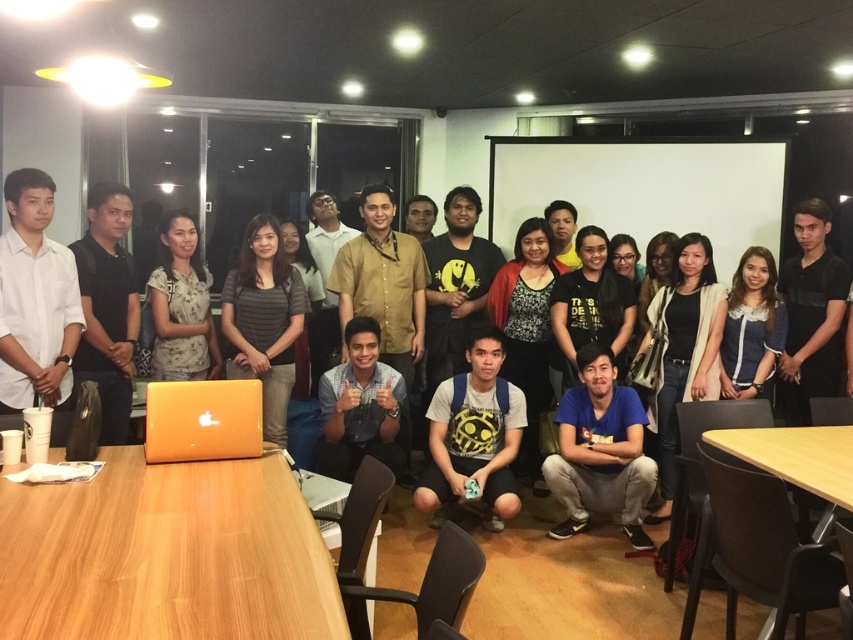
Measure the distance between point (80, 282) and camera.

Point (80, 282) is 3.53 meters away from camera.

Does matte black shirt at left have a greater height compared to light brown printed blouse at center?

Indeed, matte black shirt at left has a greater height compared to light brown printed blouse at center.

Does point (105, 230) come in front of point (195, 289)?

Yes, point (105, 230) is closer to viewer.

Where is `matte black shirt at left`? matte black shirt at left is located at coordinates [x=107, y=307].

Between light brown printed blouse at center and black matte shirt at center, which one has less height?

With less height is black matte shirt at center.

Can you confirm if light brown printed blouse at center is shorter than black matte shirt at center?

In fact, light brown printed blouse at center may be taller than black matte shirt at center.

At what (x,y) coordinates should I click in order to perform the action: click on light brown printed blouse at center. Please return your answer as a coordinate pair (x, y). This screenshot has width=853, height=640. Looking at the image, I should click on (181, 305).

Does wooden table at lower left have a larger size compared to black matte shirt at center?

Yes, wooden table at lower left is bigger than black matte shirt at center.

Does point (178, 540) come in front of point (612, 339)?

Yes, point (178, 540) is closer to viewer.

The width and height of the screenshot is (853, 640). Describe the element at coordinates (165, 554) in the screenshot. I see `wooden table at lower left` at that location.

Where is `wooden table at lower left`? This screenshot has height=640, width=853. wooden table at lower left is located at coordinates (165, 554).